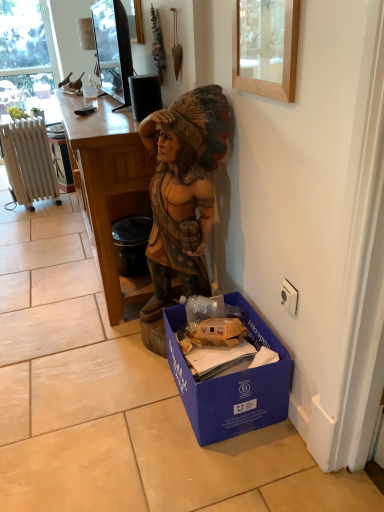
The height and width of the screenshot is (512, 384). I want to click on vacant space that is to the left of wooden statue at center, so click(114, 348).